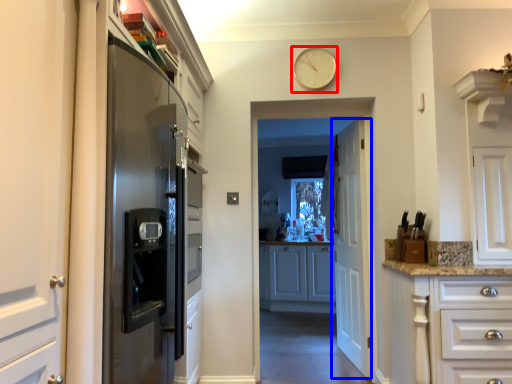
Question: Which object appears closest to the camera in this image, clock (highlighted by a red box) or door (highlighted by a blue box)?

Choices:
 (A) clock
 (B) door

Answer: (A)